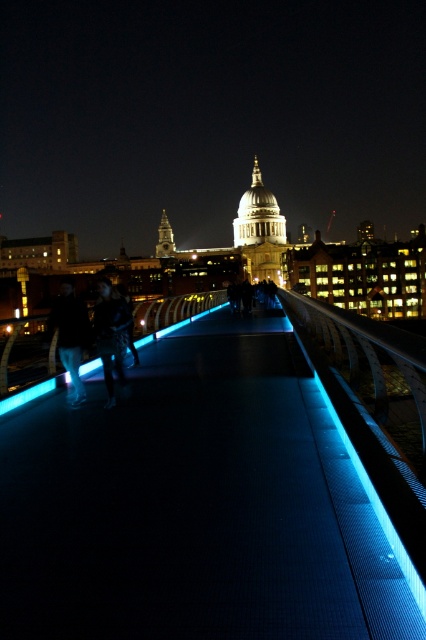
Can you confirm if dark blue jeans at left is smaller than dark blue leather jacket at center?

Indeed, dark blue jeans at left has a smaller size compared to dark blue leather jacket at center.

Is point (74, 392) positioned after point (104, 326)?

That is False.

I want to click on dark blue jeans at left, so click(x=71, y=333).

Where is `dark blue jeans at left`? This screenshot has height=640, width=426. dark blue jeans at left is located at coordinates (71, 333).